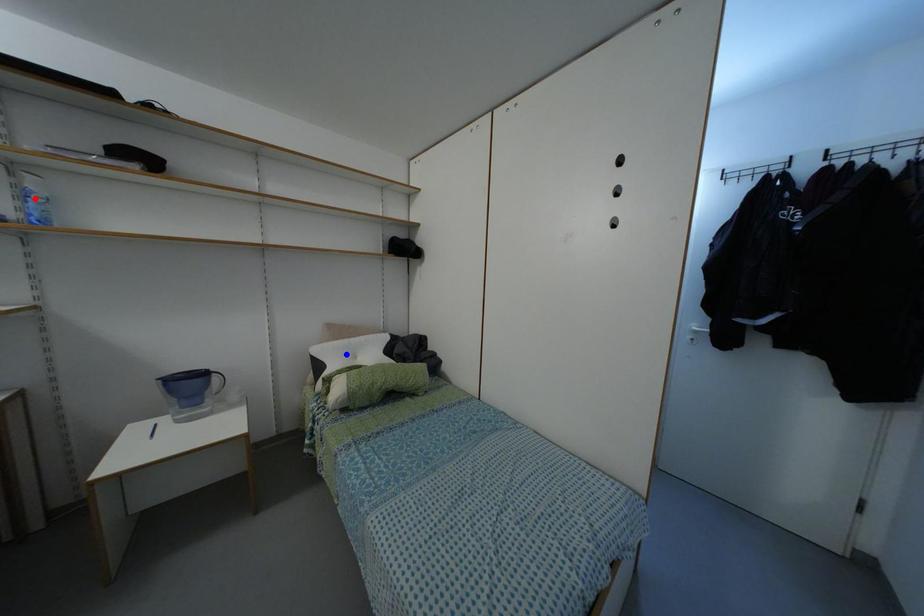
Question: Which of the two points in the image is closer to the camera?

Choices:
 (A) Blue point is closer.
 (B) Red point is closer.

Answer: (B)